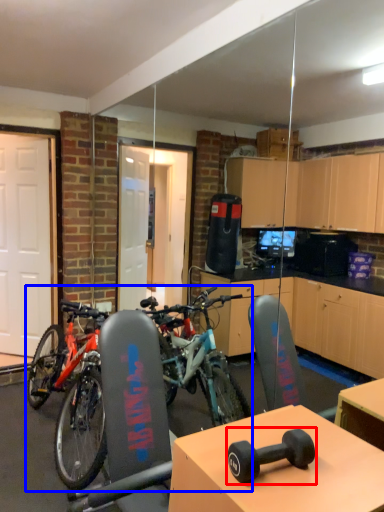
Question: Among these objects, which one is farthest to the camera, dumbbell (highlighted by a red box) or bicycle (highlighted by a blue box)?

Choices:
 (A) dumbbell
 (B) bicycle

Answer: (B)